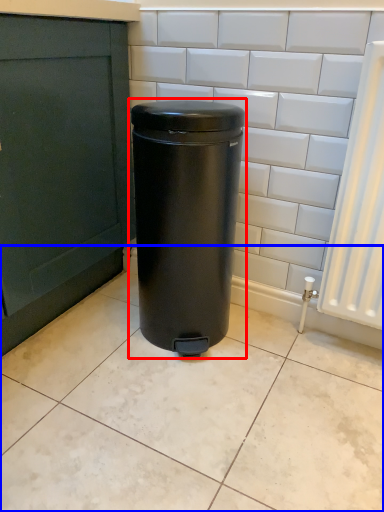
Question: Among these objects, which one is nearest to the camera, waste container (highlighted by a red box) or ceramic tile (highlighted by a blue box)?

Choices:
 (A) waste container
 (B) ceramic tile

Answer: (B)